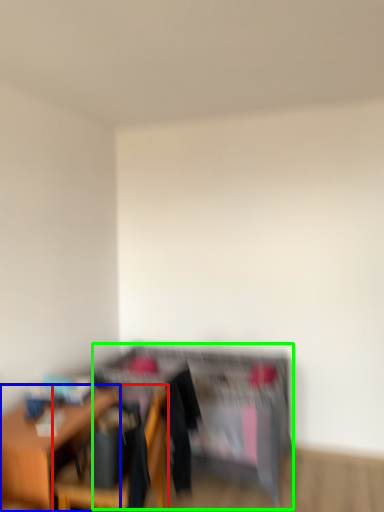
Question: Which object is the closest to the chair (highlighted by a red box)? Choose among these: table (highlighted by a blue box) or dresser (highlighted by a green box).

Choices:
 (A) table
 (B) dresser

Answer: (A)